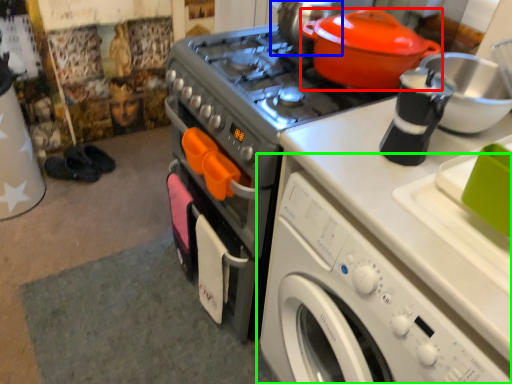
Question: Which object is positioned farthest from kitchen appliance (highlighted by a red box)? Select from tea pot (highlighted by a blue box) and washing machine (highlighted by a green box).

Choices:
 (A) tea pot
 (B) washing machine

Answer: (B)